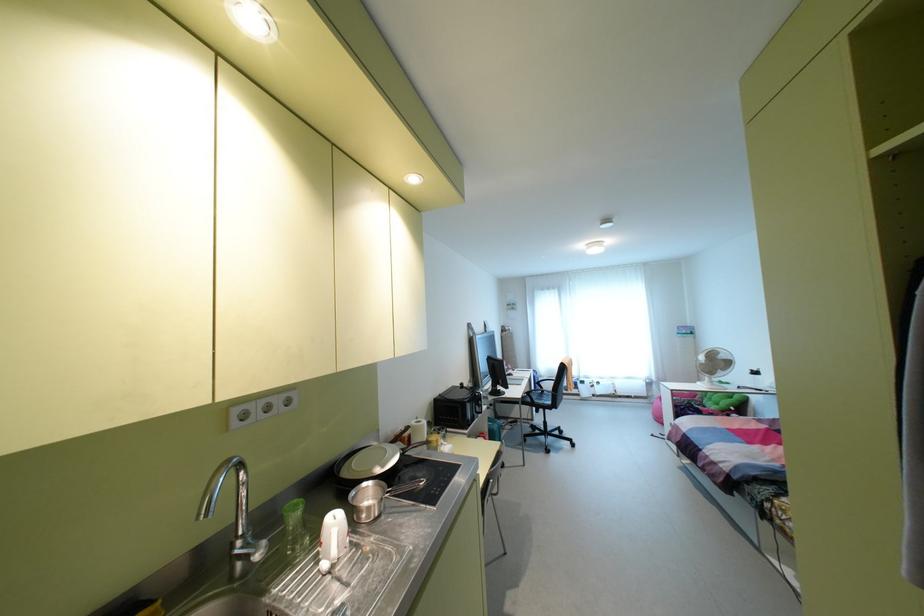
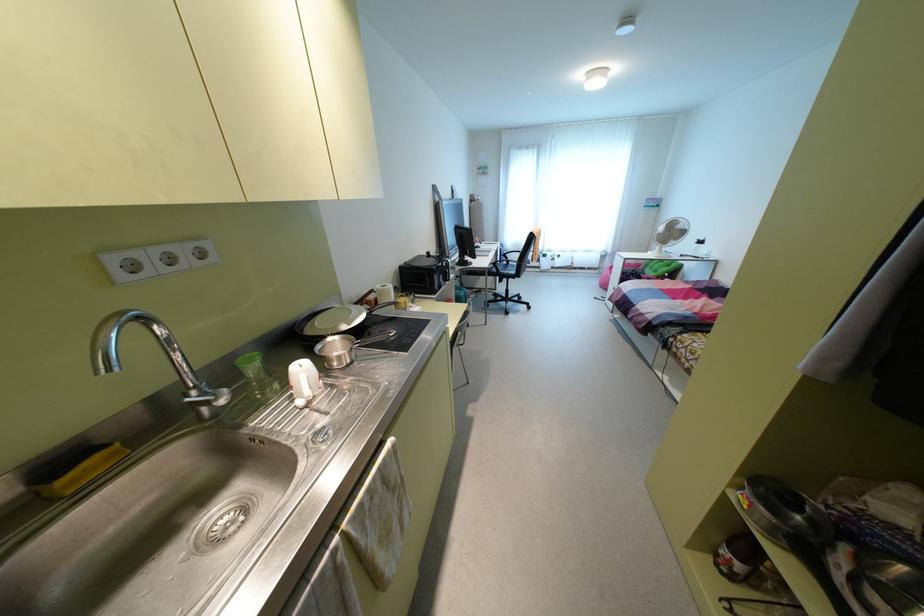
Find the pixel in the second image that matches point 382,466 in the first image.

(348, 323)